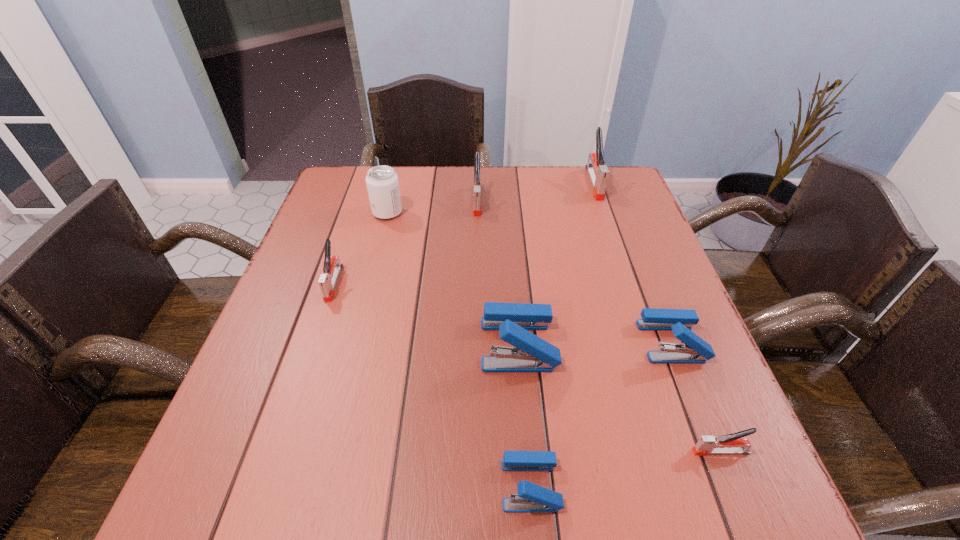
The width and height of the screenshot is (960, 540). I want to click on vacant space positioned on the handle side of the smallest gray stapler, so click(x=457, y=451).

This screenshot has width=960, height=540. In order to click on vacant space located 0.290m on the left of the smallest blue stapler in this screenshot , I will do `click(317, 484)`.

You are a GUI agent. You are given a task and a screenshot of the screen. Output one action in this format:
    pyautogui.click(x=<x>, y=<y>)
    Task: Click on the soda can that is at the far edge
    This screenshot has width=960, height=540.
    Given the screenshot: What is the action you would take?
    click(382, 184)

In order to click on object that is at the near edge in this screenshot , I will do `click(531, 497)`.

Locate an element on the screen. The width and height of the screenshot is (960, 540). soda can located in the left edge section of the desktop is located at coordinates (382, 184).

Where is `stapler at the left edge`? The image size is (960, 540). stapler at the left edge is located at coordinates (327, 281).

At what (x,y) coordinates should I click in order to perform the action: click on object that is at the far left corner. Please return your answer as a coordinate pair (x, y). Looking at the image, I should click on (382, 184).

I want to click on object at the far right corner, so click(x=598, y=173).

Identify the location of vacant space at the far edge of the desktop. (457, 174).

The image size is (960, 540). I want to click on vacant space at the near edge of the desktop, so click(623, 485).